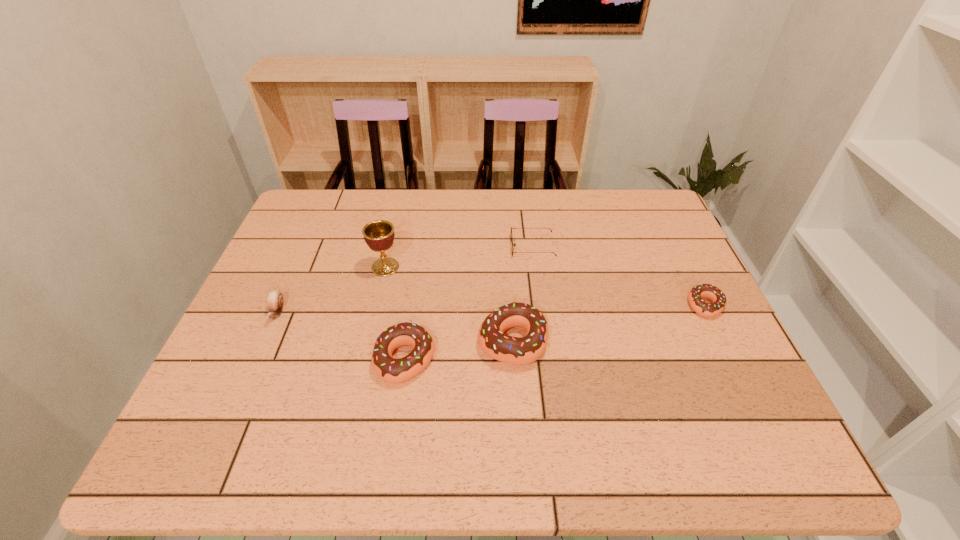
The width and height of the screenshot is (960, 540). I want to click on vacant spot for a new doughnut to ensure equal spacing, so click(612, 322).